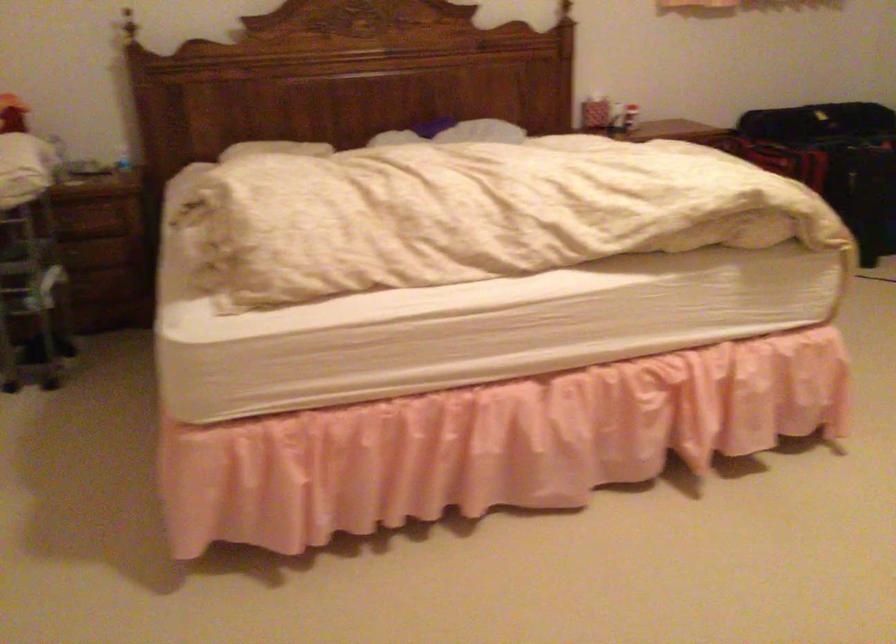
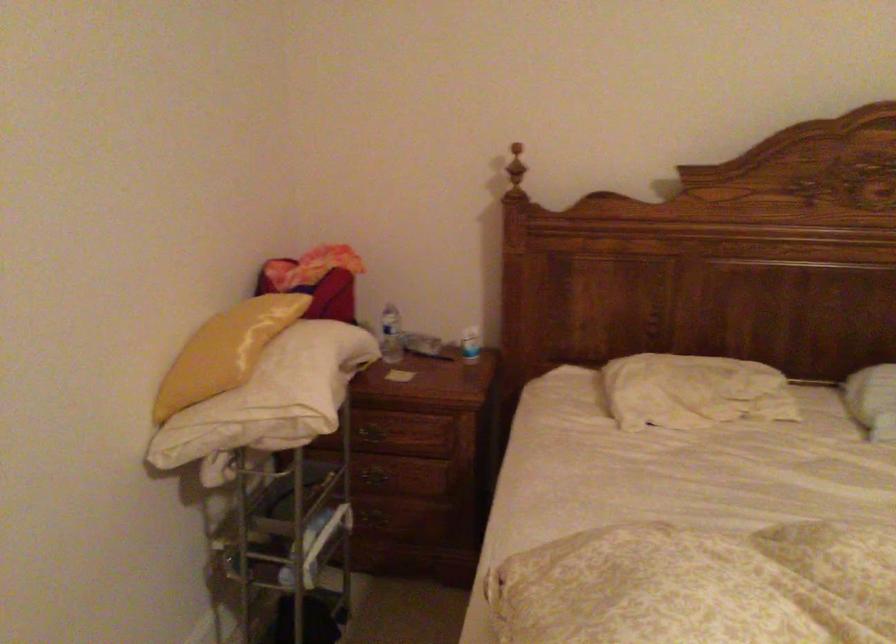
Locate, in the second image, the point that corresponds to (x=82, y=274) in the first image.

(381, 516)